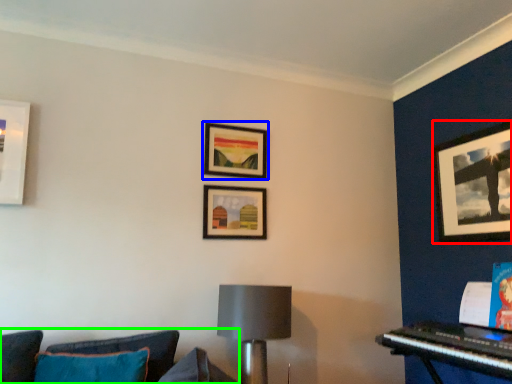
Question: Which is farther away from picture frame (highlighted by a red box)? picture frame (highlighted by a blue box) or studio couch (highlighted by a green box)?

Choices:
 (A) picture frame
 (B) studio couch

Answer: (B)